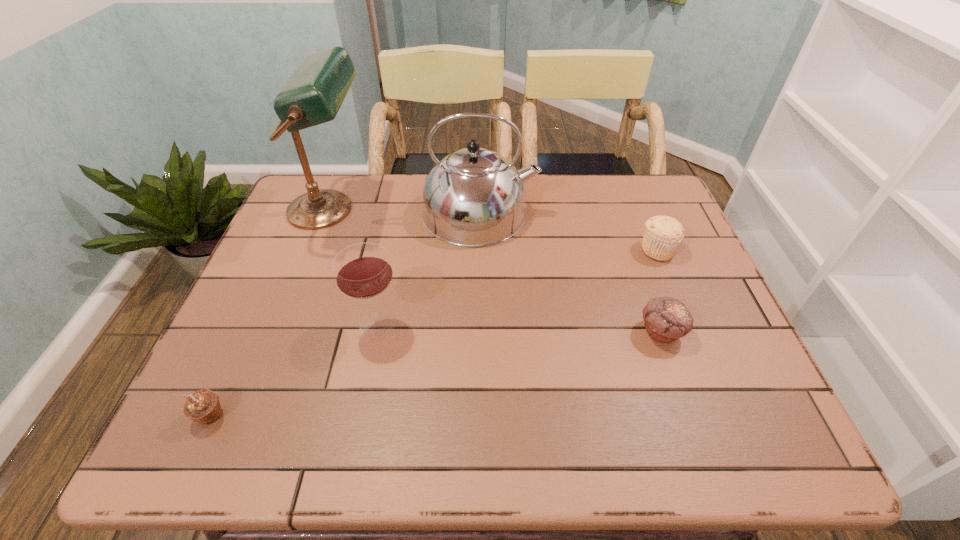
The height and width of the screenshot is (540, 960). Find the location of `object at the far left corner`. object at the far left corner is located at coordinates (314, 93).

I want to click on object at the near left corner, so click(x=203, y=406).

I want to click on vacant space at the far edge of the desktop, so click(367, 187).

Where is `vacant space at the near edge`? vacant space at the near edge is located at coordinates (508, 423).

The image size is (960, 540). In the image, there is a desktop. In order to click on blank space at the left edge in this screenshot , I will do `click(274, 342)`.

Where is `free space at the right edge of the desktop`? free space at the right edge of the desktop is located at coordinates (691, 347).

At what (x,y) coordinates should I click in order to perform the action: click on free region at the far left corner of the desktop. Please return your answer as a coordinate pair (x, y). This screenshot has width=960, height=540. Looking at the image, I should click on (348, 174).

In the image, there is a desktop. Identify the location of vacant space at the far right corner. (667, 210).

This screenshot has height=540, width=960. I want to click on free space between the farthest muffin and the third tallest object, so click(x=517, y=287).

Where is `unoccupied area between the farthest muffin and the fourth object from left to right`? This screenshot has height=540, width=960. unoccupied area between the farthest muffin and the fourth object from left to right is located at coordinates (568, 231).